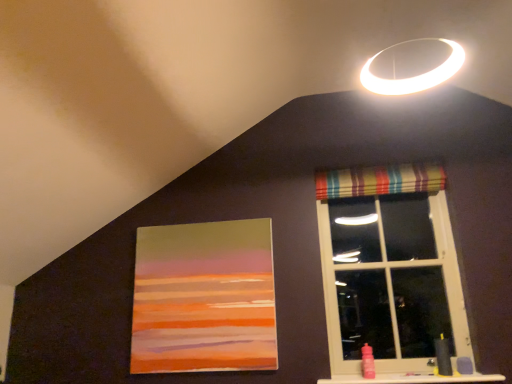
This screenshot has height=384, width=512. I want to click on free space above matte acrylic painting at center (from a real-world perspective), so click(x=200, y=220).